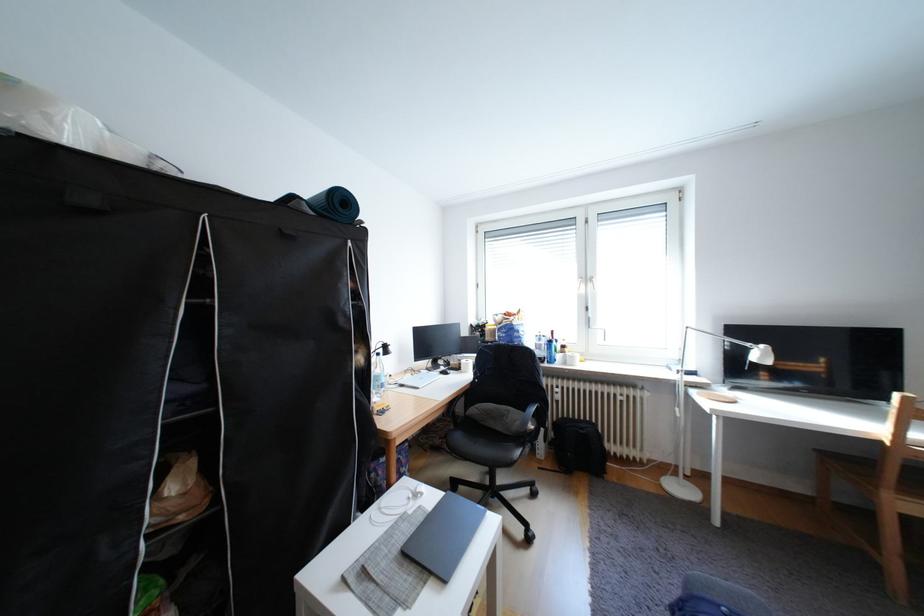
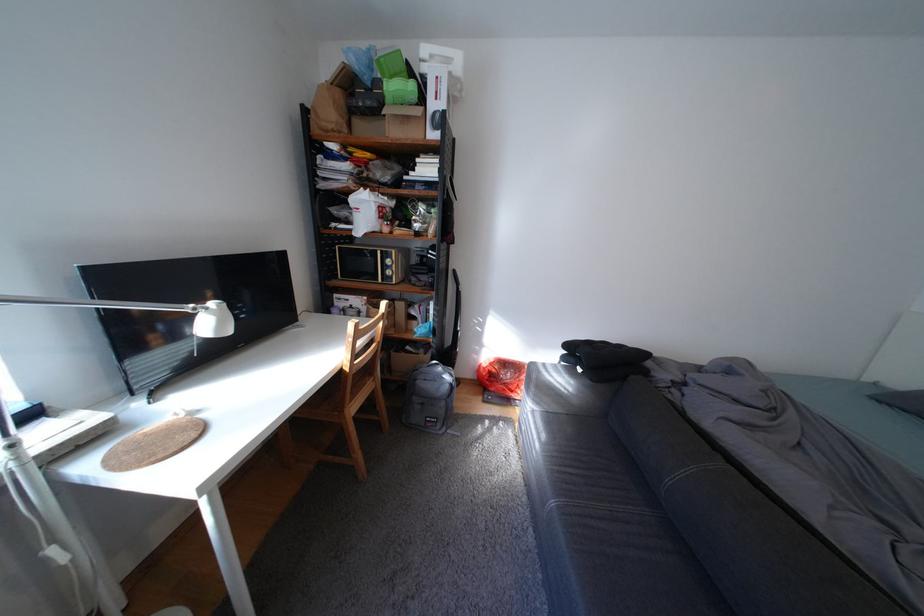
Find the pixel in the second image that matches (x=774, y=347) in the first image.

(225, 305)